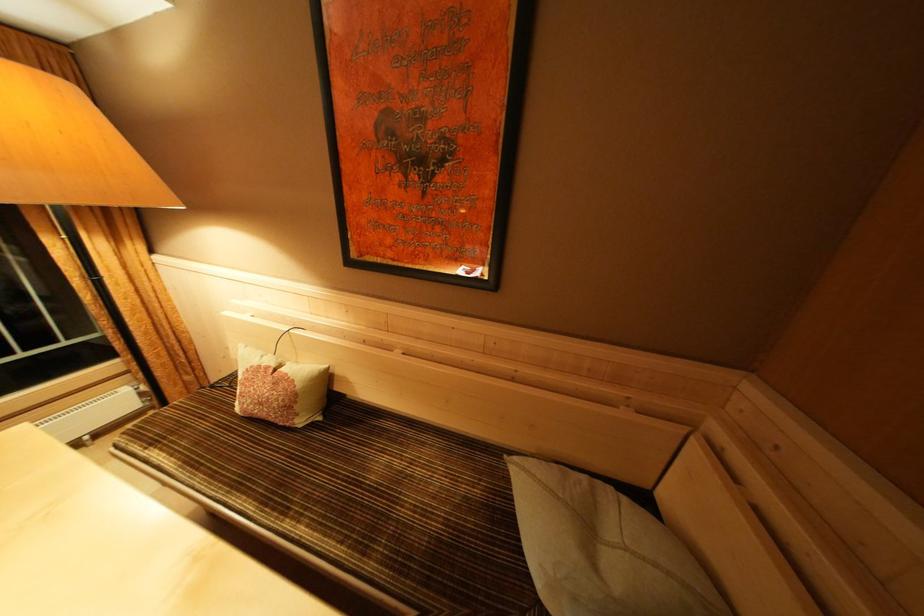
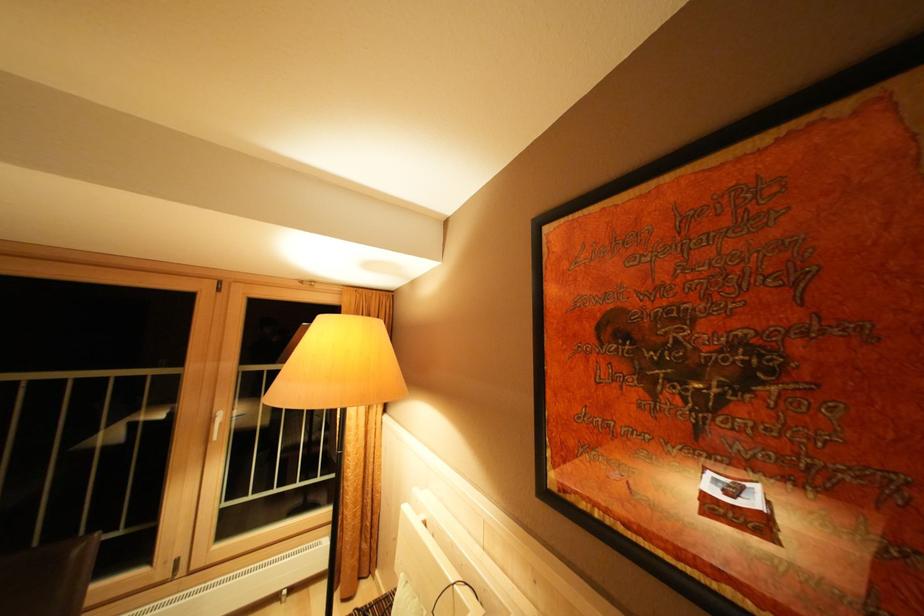
First-person continuous shooting, in which direction is the camera rotating?

The camera's rotation is toward left-up.